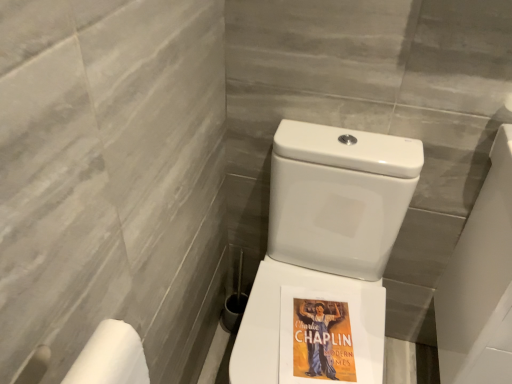
At what (x,y) coordinates should I click in order to perform the action: click on white glossy toilet at center. Please return your answer as a coordinate pair (x, y). Looking at the image, I should click on (327, 232).

Measure the distance between white glossy porcelain at right and camera.

white glossy porcelain at right and camera are 33.35 inches apart.

The height and width of the screenshot is (384, 512). What do you see at coordinates (480, 283) in the screenshot?
I see `white glossy porcelain at right` at bounding box center [480, 283].

Locate an element on the screen. white matte toilet paper at lower left is located at coordinates (110, 357).

This screenshot has width=512, height=384. I want to click on white glossy toilet at center, so coord(327,232).

Does point (134, 381) come closer to viewer compared to point (289, 235)?

That is True.

Is white matte toilet paper at lower left bigger than white glossy toilet at center?

Incorrect, white matte toilet paper at lower left is not larger than white glossy toilet at center.

Based on their positions, is white matte toilet paper at lower left located to the left or right of white glossy toilet at center?

white matte toilet paper at lower left is positioned on white glossy toilet at center's left side.

Is white glossy porcelain at right thinner than white matte toilet paper at lower left?

No, white glossy porcelain at right is not thinner than white matte toilet paper at lower left.

Is white glossy porcelain at right completely or partially outside of white matte toilet paper at lower left?

Yes, white glossy porcelain at right is not within white matte toilet paper at lower left.

Is white glossy porcelain at right not close to white matte toilet paper at lower left?

white glossy porcelain at right is actually quite close to white matte toilet paper at lower left.

Is white glossy porcelain at right at the left side of white matte toilet paper at lower left?

In fact, white glossy porcelain at right is to the right of white matte toilet paper at lower left.

Is white glossy toilet at center aimed at white matte toilet paper at lower left?

No.

From the image's perspective, which is above, white glossy toilet at center or white matte toilet paper at lower left?

white matte toilet paper at lower left.

From a real-world perspective, is white glossy toilet at center positioned above or below white matte toilet paper at lower left?

In terms of real-world spatial position, white glossy toilet at center is below white matte toilet paper at lower left.

Is white glossy toilet at center far from white matte toilet paper at lower left?

Actually, white glossy toilet at center and white matte toilet paper at lower left are a little close together.

Is white matte toilet paper at lower left facing towards white glossy porcelain at right?

No, white matte toilet paper at lower left is not turned towards white glossy porcelain at right.

From a real-world perspective, which object rests below the other?

white glossy porcelain at right.

Is white matte toilet paper at lower left to the left or to the right of white glossy porcelain at right in the image?

Clearly, white matte toilet paper at lower left is on the left of white glossy porcelain at right in the image.

Is white matte toilet paper at lower left spatially inside white glossy porcelain at right, or outside of it?

white matte toilet paper at lower left lies outside white glossy porcelain at right.

Consider the image. Is white glossy toilet at center far from white glossy porcelain at right?

Actually, white glossy toilet at center and white glossy porcelain at right are a little close together.

From the image's perspective, is white glossy toilet at center located above or below white glossy porcelain at right?

Clearly, from the image's perspective, white glossy toilet at center is below white glossy porcelain at right.

From the picture: Is white glossy porcelain at right completely or partially inside white glossy toilet at center?

No.

Considering the sizes of objects white glossy toilet at center and white glossy porcelain at right in the image provided, who is smaller, white glossy toilet at center or white glossy porcelain at right?

With smaller size is white glossy porcelain at right.

Does white glossy porcelain at right have a lesser height compared to white glossy toilet at center?

Yes.

Is white glossy porcelain at right completely or partially outside of white glossy toilet at center?

white glossy porcelain at right is positioned outside white glossy toilet at center.

Between point (509, 374) and point (401, 176), which one is positioned behind?

The point (401, 176) is farther from the camera.

Are white glossy porcelain at right and white glossy toilet at center located far from each other?

Actually, white glossy porcelain at right and white glossy toilet at center are a little close together.

You are a GUI agent. You are given a task and a screenshot of the screen. Output one action in this format:
    pyautogui.click(x=<x>, y=<y>)
    Task: Click on the toilet paper in front of the white glossy toilet at center
    The width and height of the screenshot is (512, 384).
    Given the screenshot: What is the action you would take?
    pyautogui.click(x=110, y=357)

I want to click on toilet paper above the white glossy porcelain at right (from the image's perspective), so (x=110, y=357).

When comparing their distances from white glossy toilet at center, does white glossy porcelain at right or white matte toilet paper at lower left seem closer?

white glossy porcelain at right is positioned closer to the anchor white glossy toilet at center.

Looking at the image, which one is located closer to white matte toilet paper at lower left, white glossy toilet at center or white glossy porcelain at right?

Based on the image, white glossy toilet at center appears to be nearer to white matte toilet paper at lower left.

In the scene shown: Based on their spatial positions, is white glossy toilet at center or white matte toilet paper at lower left further from white glossy porcelain at right?

Based on the image, white matte toilet paper at lower left appears to be further to white glossy porcelain at right.

Looking at the image, which one is located further to white matte toilet paper at lower left, white glossy porcelain at right or white glossy toilet at center?

white glossy porcelain at right.

Which object lies further to the anchor point white glossy porcelain at right, white matte toilet paper at lower left or white glossy toilet at center?

white matte toilet paper at lower left.

Based on their spatial positions, is white matte toilet paper at lower left or white glossy porcelain at right closer to white glossy toilet at center?

white glossy porcelain at right is closer to white glossy toilet at center.

Find the location of a particular element. toilet located between white matte toilet paper at lower left and white glossy porcelain at right in the left-right direction is located at coordinates (327, 232).